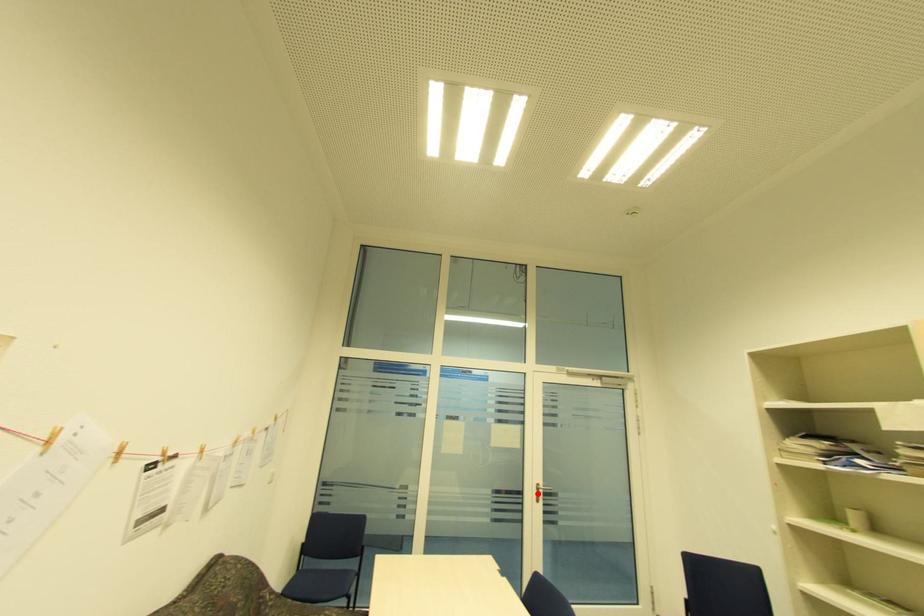
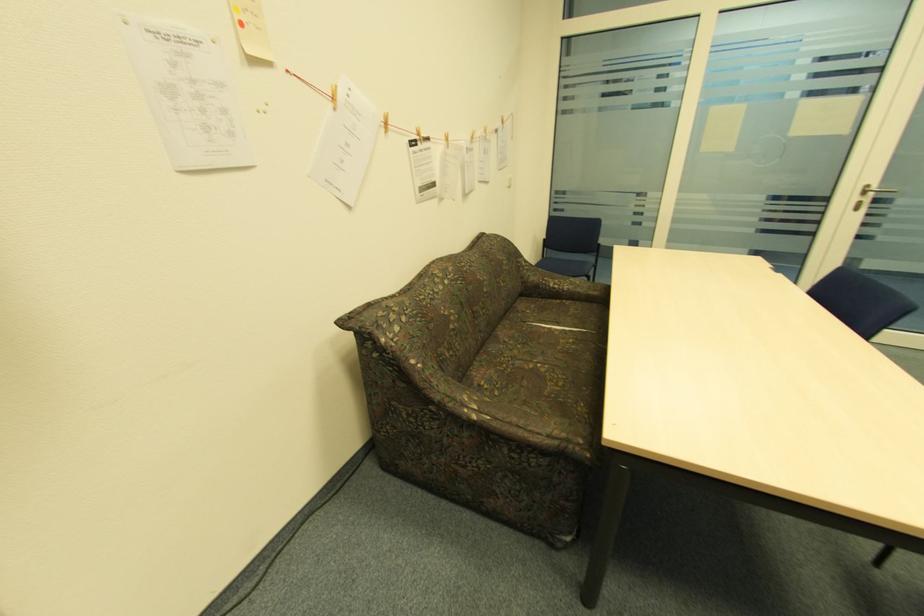
Question: I am providing you with two images of the same scene from different viewpoints. Image1 has a red point marked. In image2, the corresponding 3D location appears at what relative position? Reply with the corresponding letter.

Choices:
 (A) Closer
 (B) Farther

Answer: (A)